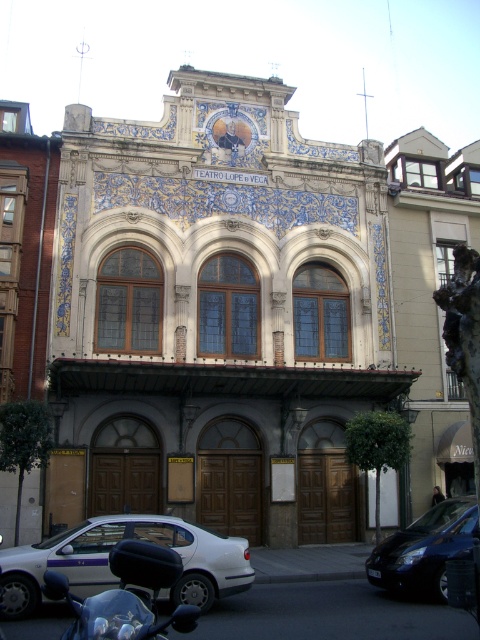
You are a delivery driver approaching the Teatro Lope de Vega. You need to park your vehicle between the white glossy sedan at center and the black matte motorcycle at lower left. Is there enough space for your van, which is 2.5 meters wide, between them?

The white glossy sedan at center is to the left of the black matte motorcycle at lower left, but the exact distance between them isn not provided in the scene description. Without knowing the spacing, it is impossible to determine if your van can fit.

You are a delivery person who needs to park your vehicle in front of the Teatro Lope de Vega. The parking space available is only 3 meters wide. Given the black matte motorcycle at lower left and the shiny blue car at lower right, which vehicle can fit into the space if the motorcycle takes up 1.5 meters and the car takes 2.5 meters?

The black matte motorcycle at lower left requires 1.5 meters and the shiny blue car at lower right needs 2.5 meters. Since the parking space is 3 meters wide, both vehicles can fit individually, but not together. If parking alone, the motorcycle would have more space remaining, while the car would take up most of the space. However, since the question asks which can fit into the space, both can fit as their individual widths are under 3 meters.

You are a photographer planning to take a picture of the Teatro Lope de Vega. You want to include both the black matte motorcycle at lower left and the shiny blue car at lower right in your frame. Which vehicle should you position closer to the camera to ensure both are fully visible without cropping?

Since the black matte motorcycle at lower left is shorter than the shiny blue car at lower right, positioning the motorcycle closer to the camera would allow both vehicles to be fully visible in the frame without cropping.